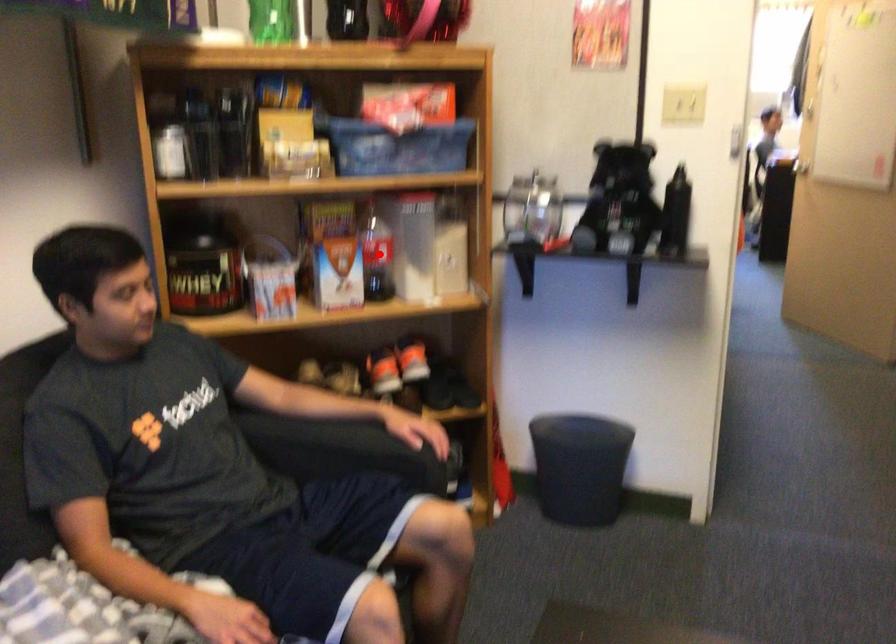
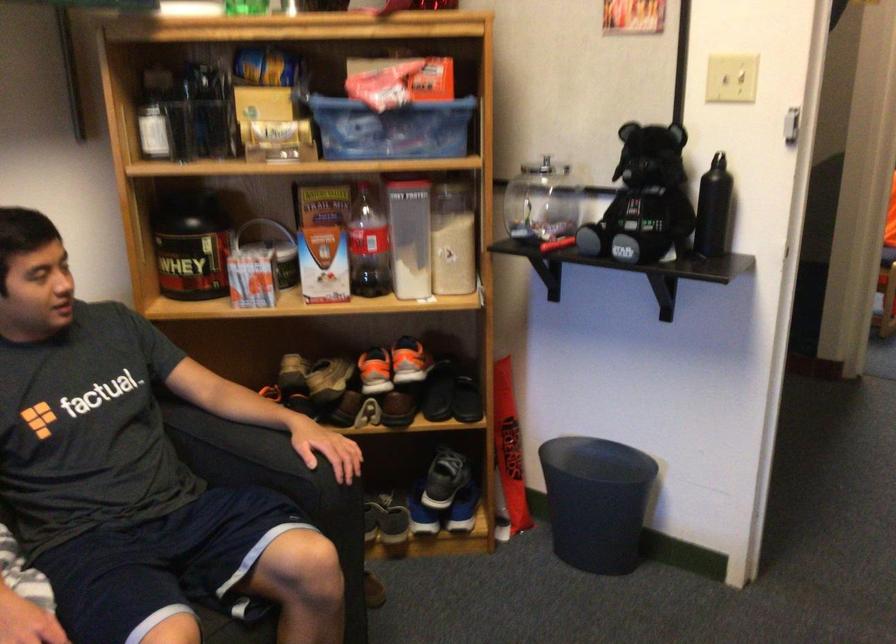
The point at the highlighted location is marked in the first image. Where is the corresponding point in the second image?

(367, 245)